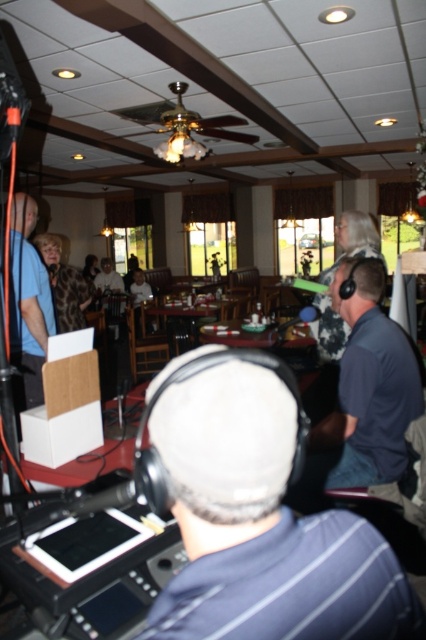
Question: Estimate the real-world distances between objects in this image. Which object is closer to the dark blue shirt at center?

Choices:
 (A) matte blue shirt at left
 (B) dark gray fabric headphones at center

Answer: (B)

Question: Considering the relative positions of dark gray fabric headphones at center and dark blue shirt at center in the image provided, where is dark gray fabric headphones at center located with respect to dark blue shirt at center?

Choices:
 (A) below
 (B) above

Answer: (A)

Question: Does dark gray fabric headphones at center have a lesser width compared to matte blue shirt at left?

Choices:
 (A) no
 (B) yes

Answer: (A)

Question: Is dark gray fabric headphones at center to the left of dark blue shirt at center from the viewer's perspective?

Choices:
 (A) no
 (B) yes

Answer: (B)

Question: Based on their relative distances, which object is nearer to the matte blue shirt at left?

Choices:
 (A) dark blue shirt at center
 (B) dark gray fabric headphones at center

Answer: (A)

Question: Based on their relative distances, which object is farther from the dark gray fabric headphones at center?

Choices:
 (A) dark blue shirt at center
 (B) matte blue shirt at left

Answer: (B)